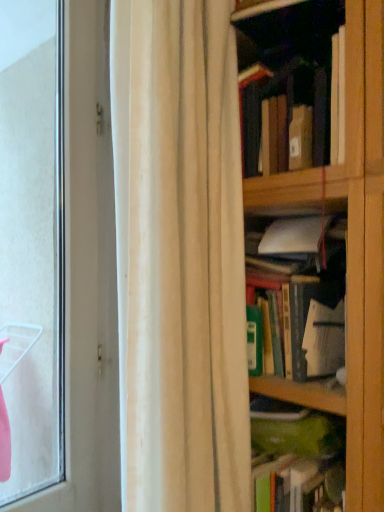
This screenshot has width=384, height=512. I want to click on green matte book at center, which appears as the 2th book when viewed from the top, so click(x=308, y=293).

Identify the location of white fabric curtain at center. The height and width of the screenshot is (512, 384). (179, 257).

How much space does hardcover book at upper right, marked as the 3th book in a bottom-to-top arrangement, occupy vertically?

hardcover book at upper right, marked as the 3th book in a bottom-to-top arrangement, is 10.81 inches in height.

Find the location of a particular element. The width and height of the screenshot is (384, 512). hardcover book at upper right, which is the first book from top to bottom is located at coordinates (338, 95).

What is the approximate width of green matte book at center, the 1th book from the bottom?

green matte book at center, the 1th book from the bottom, is 13.34 inches in width.

Where is `green matte book at center, which appears as the 2th book when viewed from the top`? The width and height of the screenshot is (384, 512). green matte book at center, which appears as the 2th book when viewed from the top is located at coordinates (308, 293).

In the scene shown: Can you confirm if white fabric curtain at center is positioned to the right of green matte book at center, which ranks as the 2th book in bottom-to-top order?

In fact, white fabric curtain at center is to the left of green matte book at center, which ranks as the 2th book in bottom-to-top order.

Measure the distance from white fabric curtain at center to green matte book at center, which ranks as the 2th book in bottom-to-top order.

9.28 inches.

Is white fabric curtain at center oriented away from green matte book at center, which appears as the 2th book when viewed from the top?

white fabric curtain at center does not have its back to green matte book at center, which appears as the 2th book when viewed from the top.

Consider the image. From a real-world perspective, is white fabric curtain at center physically located above or below green matte book at center, which ranks as the 2th book in bottom-to-top order?

In terms of real-world spatial position, white fabric curtain at center is above green matte book at center, which ranks as the 2th book in bottom-to-top order.

Between green matte book at center, which ranks as the 2th book in bottom-to-top order, and hardcover book at upper right, marked as the 3th book in a bottom-to-top arrangement, which one is positioned in front?

hardcover book at upper right, marked as the 3th book in a bottom-to-top arrangement.

From a real-world perspective, relative to hardcover book at upper right, marked as the 3th book in a bottom-to-top arrangement, is green matte book at center, which appears as the 2th book when viewed from the top, vertically above or below?

In terms of real-world spatial position, green matte book at center, which appears as the 2th book when viewed from the top, is below hardcover book at upper right, marked as the 3th book in a bottom-to-top arrangement.

Considering the points (307, 220) and (338, 76), which point is behind, point (307, 220) or point (338, 76)?

The point (307, 220) is farther.

Is green matte book at center, which ranks as the 2th book in bottom-to-top order, facing towards hardcover book at upper right, marked as the 3th book in a bottom-to-top arrangement?

No, green matte book at center, which ranks as the 2th book in bottom-to-top order, is not oriented towards hardcover book at upper right, marked as the 3th book in a bottom-to-top arrangement.

What's the angular difference between transparent glass window at left and green matte book at center, which ranks as the 3th book in top-to-bottom order,'s facing directions?

transparent glass window at left and green matte book at center, which ranks as the 3th book in top-to-bottom order, are facing 89.6 degrees away from each other.

From a real-world perspective, who is located lower, transparent glass window at left or green matte book at center, which ranks as the 3th book in top-to-bottom order?

In real-world perspective, green matte book at center, which ranks as the 3th book in top-to-bottom order, is lower.

Considering the points (50, 66) and (339, 436), which point is behind, point (50, 66) or point (339, 436)?

Point (50, 66)

Which point is more forward, (304, 218) or (45, 68)?

Positioned in front is point (304, 218).

Is green matte book at center, which appears as the 2th book when viewed from the top, turned away from transparent glass window at left?

That's not correct — green matte book at center, which appears as the 2th book when viewed from the top, is not looking away from transparent glass window at left.

Which is more to the left, green matte book at center, which ranks as the 2th book in bottom-to-top order, or transparent glass window at left?

Positioned to the left is transparent glass window at left.

Considering the sizes of objects green matte book at center, which appears as the 2th book when viewed from the top, and transparent glass window at left in the image provided, who is wider, green matte book at center, which appears as the 2th book when viewed from the top, or transparent glass window at left?

green matte book at center, which appears as the 2th book when viewed from the top.

From the image's perspective, between white fabric curtain at center and transparent glass window at left, which one is located above?

white fabric curtain at center is shown above in the image.

Is white fabric curtain at center surrounding transparent glass window at left?

Actually, transparent glass window at left is outside white fabric curtain at center.

Is white fabric curtain at center closer to camera compared to transparent glass window at left?

Yes, it is.

Considering the positions of point (179, 298) and point (12, 182), is point (179, 298) closer or farther from the camera than point (12, 182)?

Point (179, 298) is closer to the camera than point (12, 182).

From a real-world perspective, which object rests below the other?

green matte book at center, the 1th book from the bottom, from a real-world perspective.

Is green matte book at center, the 1th book from the bottom, bigger than hardcover book at upper right, which is the first book from top to bottom?

Incorrect, green matte book at center, the 1th book from the bottom, is not larger than hardcover book at upper right, which is the first book from top to bottom.

From the image's perspective, is green matte book at center, which ranks as the 3th book in top-to-bottom order, above or below hardcover book at upper right, marked as the 3th book in a bottom-to-top arrangement?

green matte book at center, which ranks as the 3th book in top-to-bottom order, is below hardcover book at upper right, marked as the 3th book in a bottom-to-top arrangement.

Is green matte book at center, the 1th book from the bottom, aimed at hardcover book at upper right, marked as the 3th book in a bottom-to-top arrangement?

No, green matte book at center, the 1th book from the bottom, is not aimed at hardcover book at upper right, marked as the 3th book in a bottom-to-top arrangement.

Would you say green matte book at center, which ranks as the 2th book in bottom-to-top order, is part of green matte book at center, which ranks as the 3th book in top-to-bottom order,'s contents?

No, green matte book at center, which ranks as the 2th book in bottom-to-top order, is not surrounded by green matte book at center, which ranks as the 3th book in top-to-bottom order.

Is green matte book at center, which ranks as the 3th book in top-to-bottom order, wider than green matte book at center, which ranks as the 2th book in bottom-to-top order?

No, green matte book at center, which ranks as the 3th book in top-to-bottom order, is not wider than green matte book at center, which ranks as the 2th book in bottom-to-top order.

Find the location of a particular element. The image size is (384, 512). book that is the 2nd object to the right of the green matte book at center, which ranks as the 3th book in top-to-bottom order, starting at the anchor is located at coordinates (308, 293).

Is the position of green matte book at center, the 1th book from the bottom, less distant than that of green matte book at center, which appears as the 2th book when viewed from the top?

Yes, green matte book at center, the 1th book from the bottom, is in front of green matte book at center, which appears as the 2th book when viewed from the top.

From the white fabric curtain at center, count 3rd books backward and point to it. Please provide its 2D coordinates.

[(308, 293)]

Image resolution: width=384 pixels, height=512 pixels. Identify the location of the 1st book below the hardcover book at upper right, which is the first book from top to bottom (from the image's perspective). (308, 293).

Considering their positions, is green matte book at center, which appears as the 2th book when viewed from the top, positioned further to hardcover book at upper right, which is the first book from top to bottom, than green matte book at center, which ranks as the 3th book in top-to-bottom order?

The object further to hardcover book at upper right, which is the first book from top to bottom, is green matte book at center, which ranks as the 3th book in top-to-bottom order.

Estimate the real-world distances between objects in this image. Which object is closer to hardcover book at upper right, marked as the 3th book in a bottom-to-top arrangement, green matte book at center, which appears as the 2th book when viewed from the top, or transparent glass window at left?

Based on the image, green matte book at center, which appears as the 2th book when viewed from the top, appears to be nearer to hardcover book at upper right, marked as the 3th book in a bottom-to-top arrangement.

When comparing their distances from green matte book at center, the 1th book from the bottom, does transparent glass window at left or white fabric curtain at center seem closer?

white fabric curtain at center is closer to green matte book at center, the 1th book from the bottom.

When comparing their distances from green matte book at center, which ranks as the 2th book in bottom-to-top order, does green matte book at center, the 1th book from the bottom, or white fabric curtain at center seem closer?

green matte book at center, the 1th book from the bottom, lies closer to green matte book at center, which ranks as the 2th book in bottom-to-top order, than the other object.

Based on their spatial positions, is transparent glass window at left or white fabric curtain at center further from green matte book at center, which ranks as the 2th book in bottom-to-top order?

Among the two, transparent glass window at left is located further to green matte book at center, which ranks as the 2th book in bottom-to-top order.

Looking at the image, which one is located further to white fabric curtain at center, hardcover book at upper right, which is the first book from top to bottom, or green matte book at center, which ranks as the 2th book in bottom-to-top order?

hardcover book at upper right, which is the first book from top to bottom.

When comparing their distances from green matte book at center, which ranks as the 3th book in top-to-bottom order, does green matte book at center, which appears as the 2th book when viewed from the top, or hardcover book at upper right, marked as the 3th book in a bottom-to-top arrangement, seem further?

hardcover book at upper right, marked as the 3th book in a bottom-to-top arrangement, lies further to green matte book at center, which ranks as the 3th book in top-to-bottom order, than the other object.

Estimate the real-world distances between objects in this image. Which object is closer to green matte book at center, which ranks as the 2th book in bottom-to-top order, white fabric curtain at center or transparent glass window at left?

white fabric curtain at center is positioned closer to the anchor green matte book at center, which ranks as the 2th book in bottom-to-top order.

Where is `curtain between hardcover book at upper right, which is the first book from top to bottom, and green matte book at center, the 1th book from the bottom, in the up-down direction`? curtain between hardcover book at upper right, which is the first book from top to bottom, and green matte book at center, the 1th book from the bottom, in the up-down direction is located at coordinates (179, 257).

Locate an element on the screen. curtain between transparent glass window at left and hardcover book at upper right, marked as the 3th book in a bottom-to-top arrangement, from left to right is located at coordinates (179, 257).

Find the location of `curtain between hardcover book at upper right, marked as the 3th book in a bottom-to-top arrangement, and green matte book at center, which appears as the 2th book when viewed from the top, in the up-down direction`. curtain between hardcover book at upper right, marked as the 3th book in a bottom-to-top arrangement, and green matte book at center, which appears as the 2th book when viewed from the top, in the up-down direction is located at coordinates (179, 257).

Find the location of a particular element. This screenshot has width=384, height=512. book that lies between white fabric curtain at center and green matte book at center, which ranks as the 3th book in top-to-bottom order, from top to bottom is located at coordinates (308, 293).